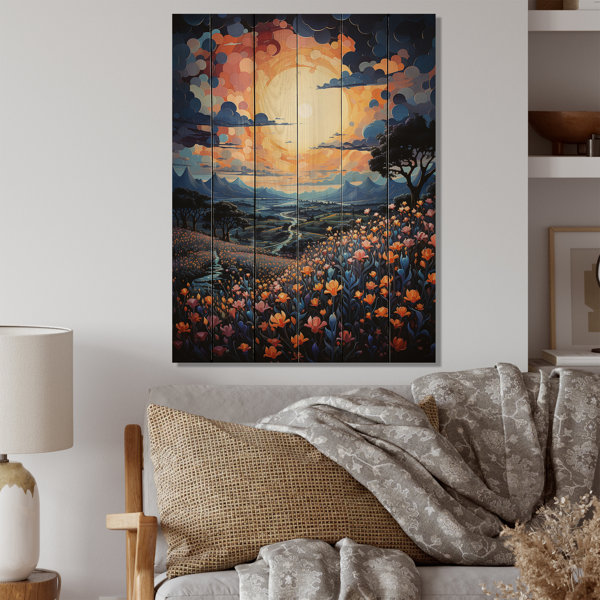
The height and width of the screenshot is (600, 600). Find the location of `white lamp shade`. white lamp shade is located at coordinates (35, 396).